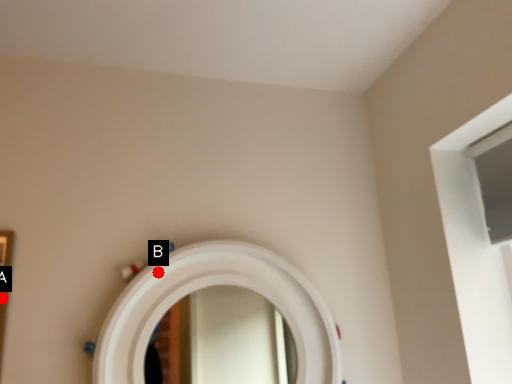
Question: Two points are circled on the image, labeled by A and B beside each circle. Which point is farther from the camera taking this photo?

Choices:
 (A) A is further
 (B) B is further

Answer: (B)